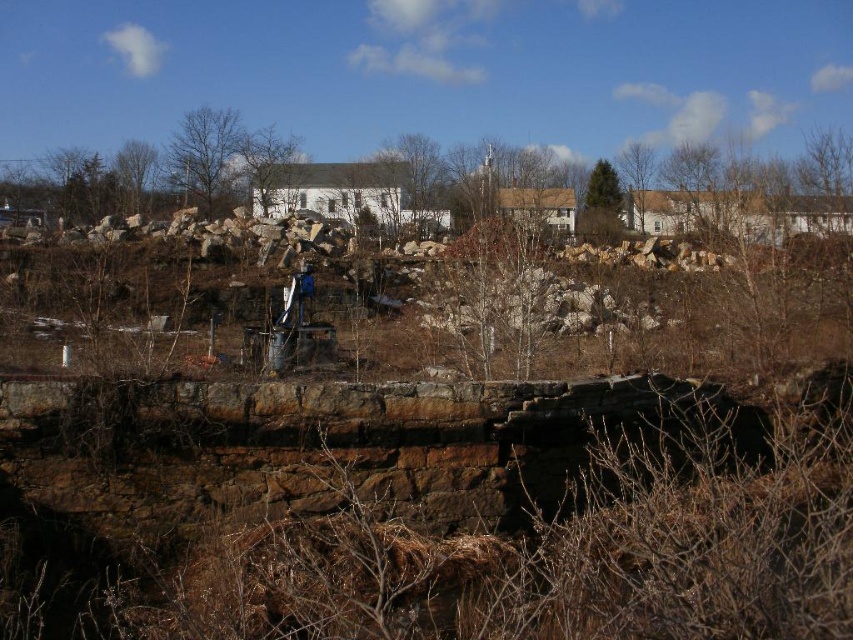
Can you confirm if bare branches at upper left is taller than green textured tree at upper center?

Correct, bare branches at upper left is much taller as green textured tree at upper center.

Between bare branches at upper left and green textured tree at upper center, which one appears on the right side from the viewer's perspective?

Positioned to the right is green textured tree at upper center.

Is point (173, 163) positioned in front of point (585, 204)?

That is True.

At what (x,y) coordinates should I click in order to perform the action: click on bare branches at upper left. Please return your answer as a coordinate pair (x, y). The width and height of the screenshot is (853, 640). Looking at the image, I should click on (206, 156).

Does point (247, 152) come closer to viewer compared to point (653, 154)?

Yes, point (247, 152) is closer to viewer.

Find the location of a particular element. The width and height of the screenshot is (853, 640). brown leafless tree at center is located at coordinates (267, 163).

The width and height of the screenshot is (853, 640). What are the coordinates of `brown leafless tree at center` in the screenshot? It's located at (267, 163).

Does bare branches at upper left appear under brown leafless tree at center?

Actually, bare branches at upper left is above brown leafless tree at center.

Is point (204, 113) in front of point (256, 204)?

That is False.

Locate an element on the screen. The height and width of the screenshot is (640, 853). bare branches at upper left is located at coordinates (206, 156).